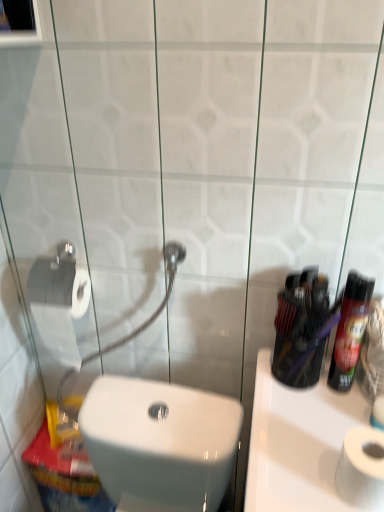
Question: Is the position of shiny black spray can at right more distant than that of white matte toilet paper at lower right?

Choices:
 (A) yes
 (B) no

Answer: (A)

Question: Is shiny black spray can at right smaller than white matte toilet paper at lower right?

Choices:
 (A) yes
 (B) no

Answer: (A)

Question: Is shiny black spray can at right closer to the viewer compared to white matte toilet paper at lower right?

Choices:
 (A) yes
 (B) no

Answer: (B)

Question: From a real-world perspective, is shiny black spray can at right over white matte toilet paper at lower right?

Choices:
 (A) yes
 (B) no

Answer: (A)

Question: Is shiny black spray can at right at the left side of white matte toilet paper at lower right?

Choices:
 (A) yes
 (B) no

Answer: (B)

Question: Is shiny black spray can at right bigger than white matte toilet paper at lower right?

Choices:
 (A) no
 (B) yes

Answer: (A)

Question: Considering the relative sizes of white glossy toilet at lower left and white glossy sink at right in the image provided, is white glossy toilet at lower left wider than white glossy sink at right?

Choices:
 (A) yes
 (B) no

Answer: (B)

Question: Is white glossy toilet at lower left bigger than white glossy sink at right?

Choices:
 (A) yes
 (B) no

Answer: (B)

Question: Could you tell me if white glossy toilet at lower left is turned towards white glossy sink at right?

Choices:
 (A) yes
 (B) no

Answer: (B)

Question: Does white glossy toilet at lower left appear on the right side of white glossy sink at right?

Choices:
 (A) no
 (B) yes

Answer: (A)

Question: From a real-world perspective, is white glossy toilet at lower left on top of white glossy sink at right?

Choices:
 (A) no
 (B) yes

Answer: (B)

Question: From the image's perspective, is white glossy toilet at lower left under white glossy sink at right?

Choices:
 (A) no
 (B) yes

Answer: (A)

Question: Does shiny black spray can at right have a greater height compared to white glossy toilet at lower left?

Choices:
 (A) no
 (B) yes

Answer: (A)